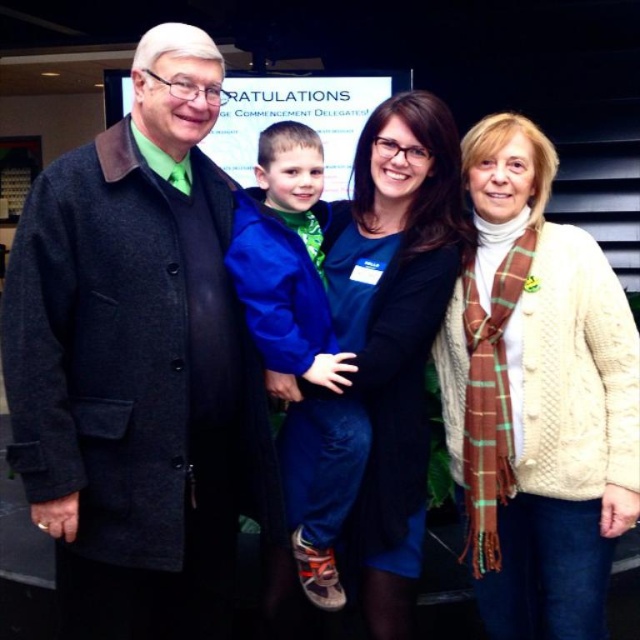
Question: Which object is farther from the camera taking this photo?

Choices:
 (A) matte black coat at left
 (B) white cable-knit sweater at center
 (C) blue fleece jacket at center
 (D) cable knit sweater at center

Answer: (D)

Question: Among these objects, which one is farthest from the camera?

Choices:
 (A) white cable-knit sweater at center
 (B) cable knit sweater at center

Answer: (B)

Question: Does matte black coat at left have a smaller size compared to cable knit sweater at center?

Choices:
 (A) no
 (B) yes

Answer: (A)

Question: Does cable knit sweater at center come behind blue fleece jacket at center?

Choices:
 (A) no
 (B) yes

Answer: (B)

Question: Which object appears closest to the camera in this image?

Choices:
 (A) cable knit sweater at center
 (B) white cable-knit sweater at center

Answer: (B)

Question: Can you confirm if matte black coat at left is positioned below cable knit sweater at center?

Choices:
 (A) no
 (B) yes

Answer: (B)